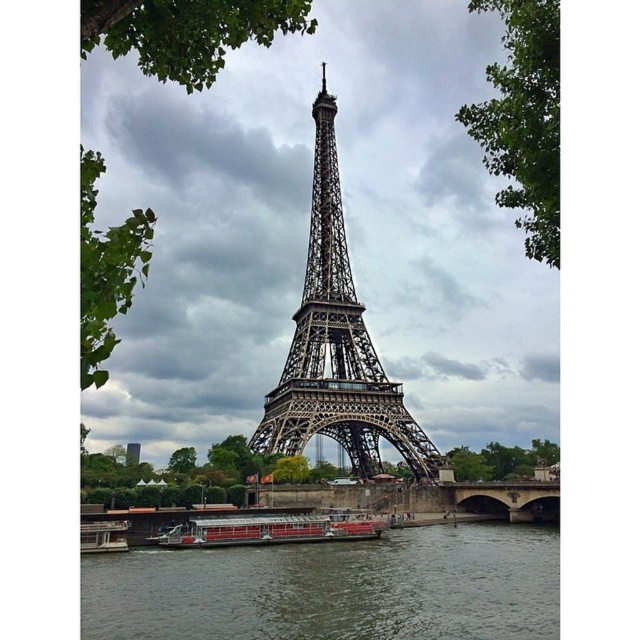
You are a tourist standing on the Seine River bank and want to take a photo of the metallic structure at center and the red polished wood boat at lower center. Can you frame both objects in the same photo without moving your position?

The metallic structure at center is located above the red polished wood boat at lower center, so yes, you can frame both objects in the same photo without moving your position since they are vertically aligned.

Based on the coordinates provided in the image, where exactly is the metallic structure at center located?

The metallic structure at center is located at the coordinates point (337, 346).